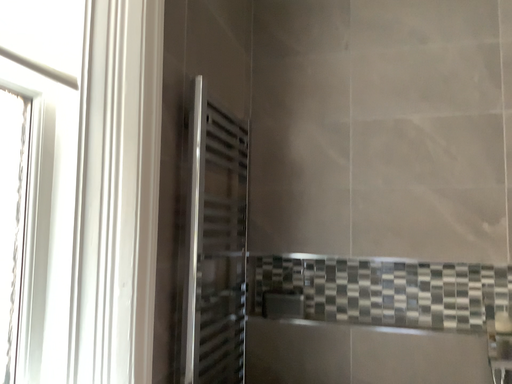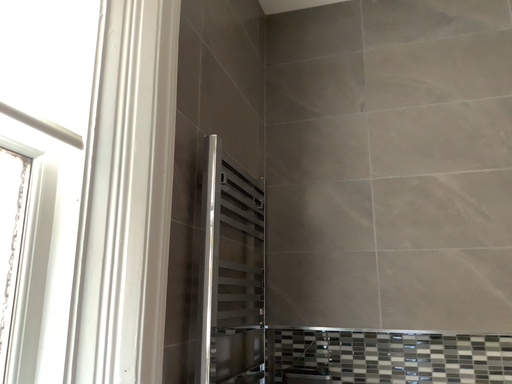
Question: How did the camera likely rotate when shooting the video?

Choices:
 (A) rotated upward
 (B) rotated downward

Answer: (A)